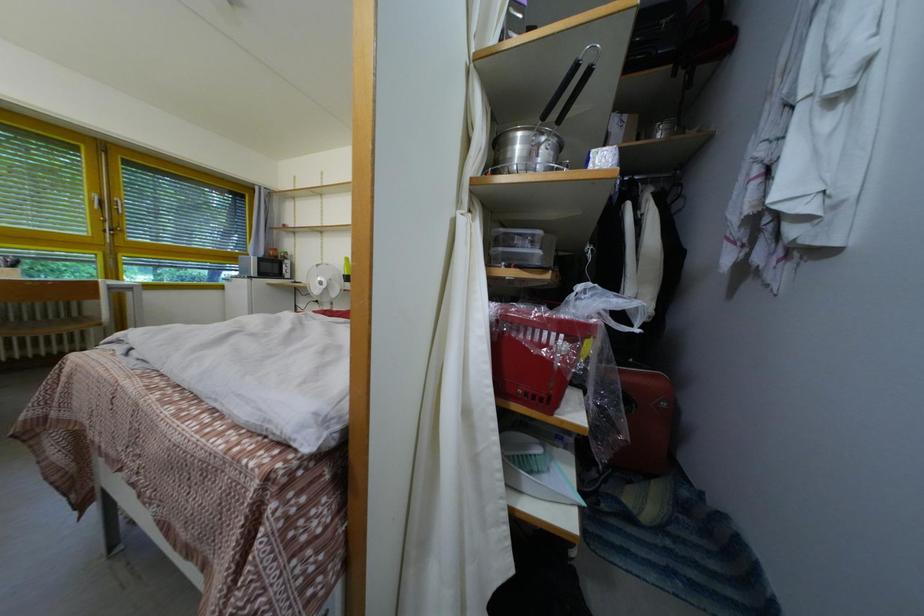
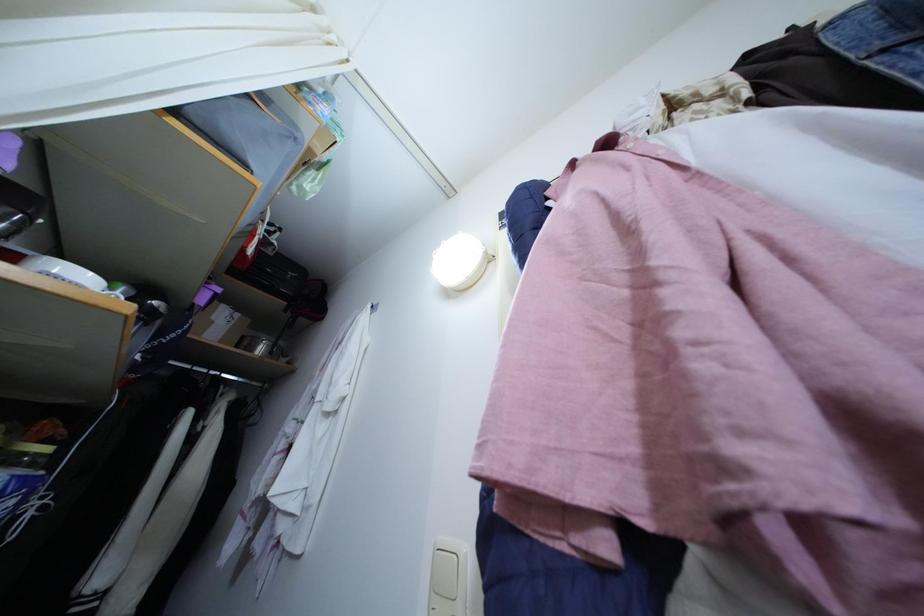
How did the camera likely rotate?

The rotation direction of the camera is right-up.